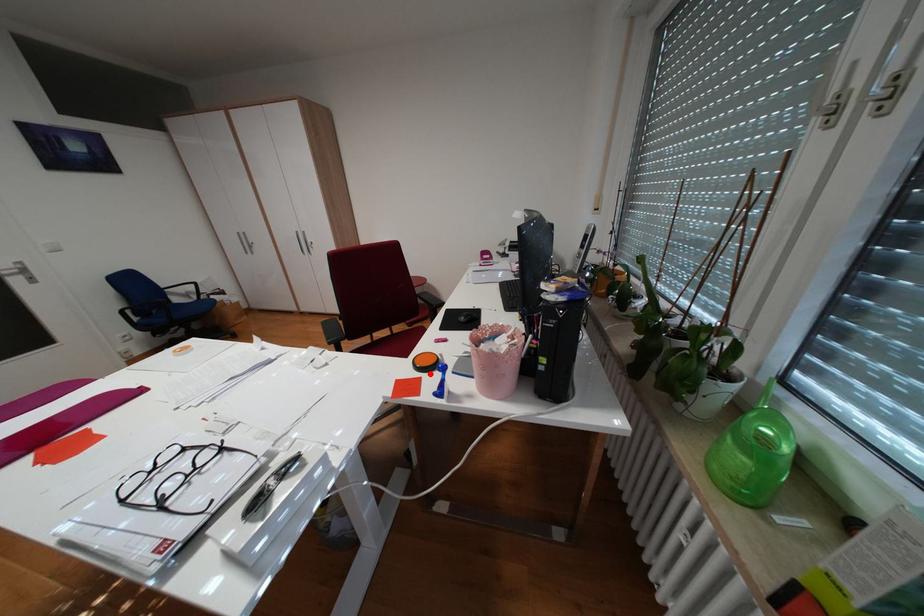
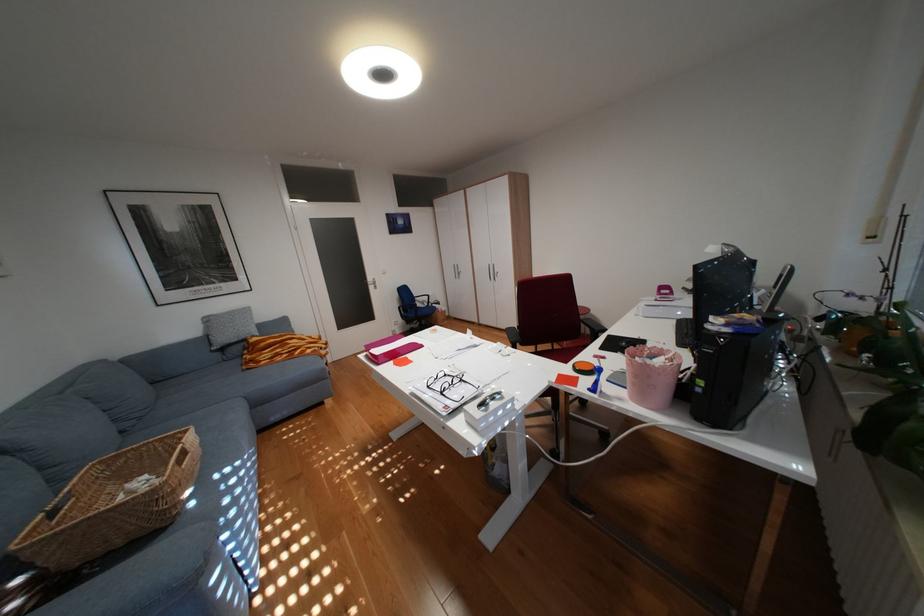
Where in the second image is the point corresponding to the highlighted location from the first image?

(589, 374)